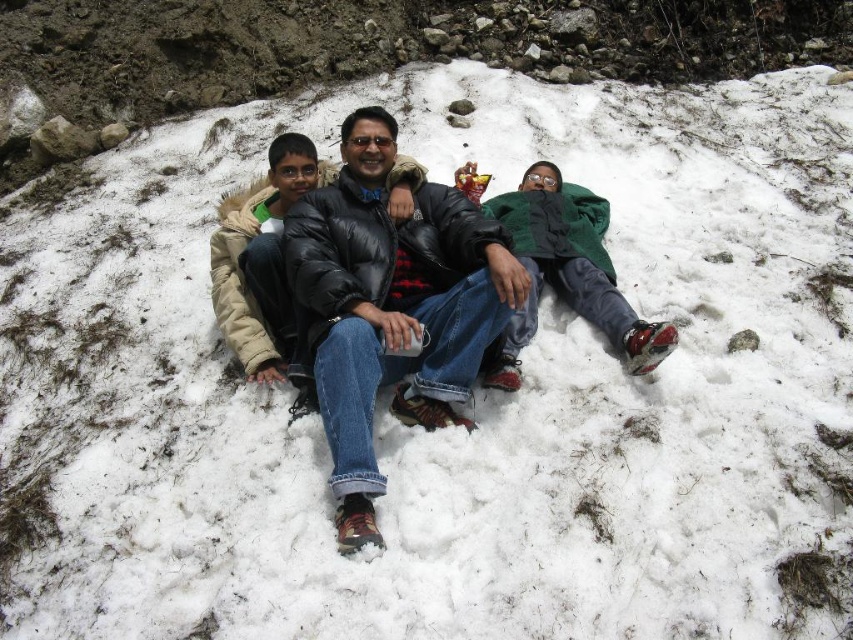
Looking at this image, you are a photographer standing 10 feet away from the two people in the center of the snowy slope. You want to take a photo of both the green matte jacket at center and the black puffer jacket at center in the same frame. Can you fit both of them in your camera view if your camera has a 5 feet wide field of view?

The distance between the green matte jacket at center and the black puffer jacket at center is 4.59 feet. Since your camera has a 5 feet wide field of view and you are 10 feet away, the entire 4.59 feet between them would fit within the 5 feet width, so yes, both can be captured in the same frame.